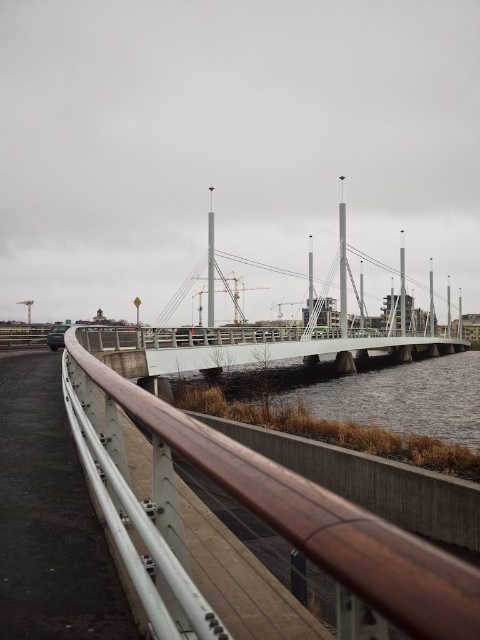
Is point (249, 486) positioned in front of point (411, 336)?

Yes, it is in front of point (411, 336).

Which is in front, point (72, 432) or point (96, 342)?

Point (72, 432)

Identify the location of brown metallic rail at lower left. This screenshot has height=640, width=480. (252, 515).

Based on the photo, does white concrete bridge at center appear on the right side of metallic silver car at left?

Correct, you'll find white concrete bridge at center to the right of metallic silver car at left.

Based on the photo, does white concrete bridge at center have a lesser width compared to metallic silver car at left?

Incorrect, white concrete bridge at center's width is not less than metallic silver car at left's.

This screenshot has width=480, height=640. I want to click on white concrete bridge at center, so click(x=242, y=346).

Which of these two, brown metallic rail at lower left or metallic silver car at left, stands taller?

Standing taller between the two is brown metallic rail at lower left.

Can you confirm if brown metallic rail at lower left is positioned below metallic silver car at left?

Correct, brown metallic rail at lower left is located below metallic silver car at left.

Between point (330, 538) and point (48, 336), which one is positioned behind?

Point (48, 336)

Locate an element on the screen. This screenshot has width=480, height=640. brown metallic rail at lower left is located at coordinates (252, 515).